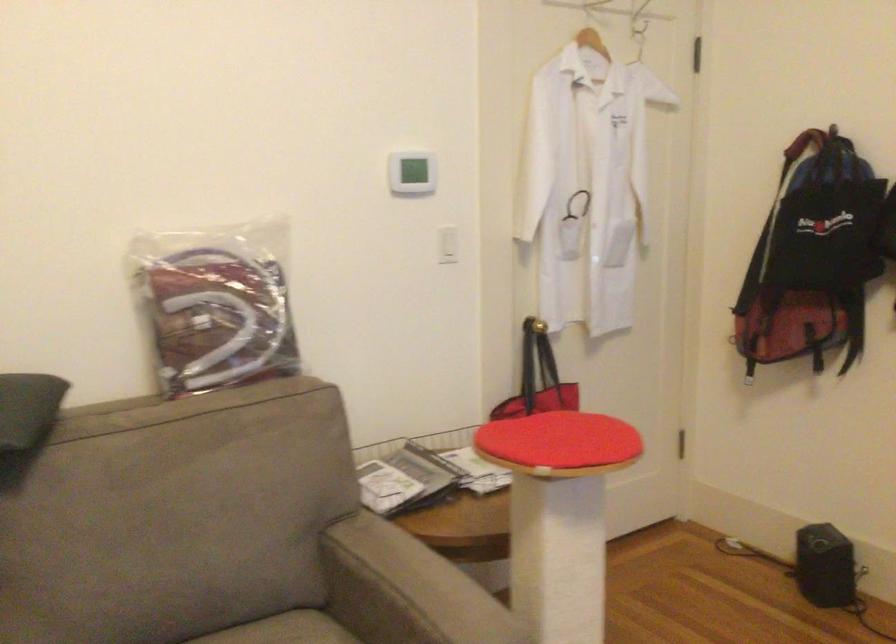
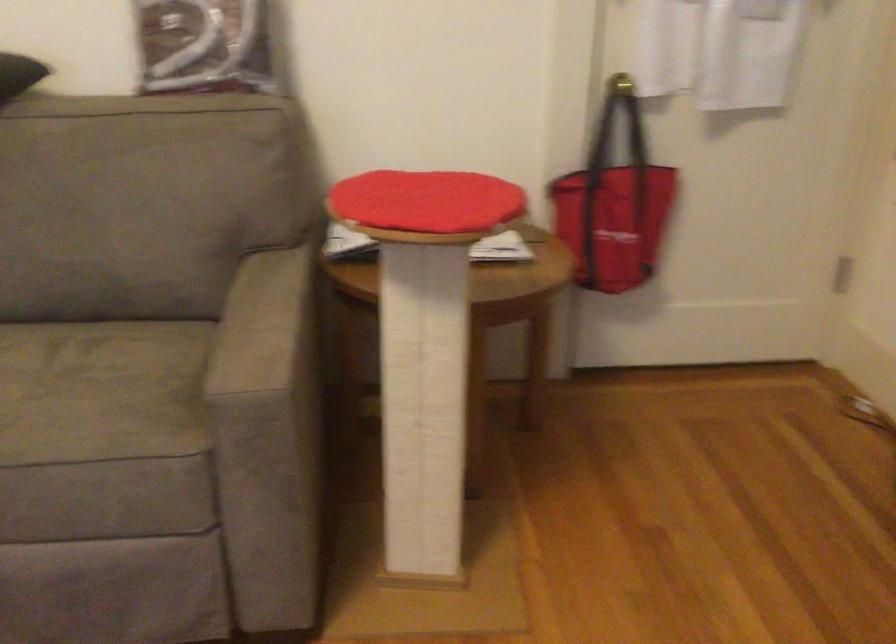
The point at (530, 355) is marked in the first image. Where is the corresponding point in the second image?

(616, 124)